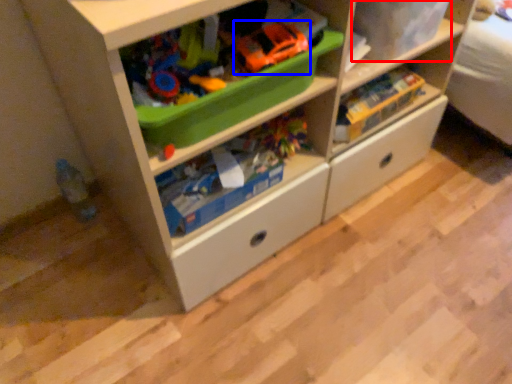
Question: Which object appears closest to the camera in this image, storage box (highlighted by a red box) or toy car (highlighted by a blue box)?

Choices:
 (A) storage box
 (B) toy car

Answer: (B)